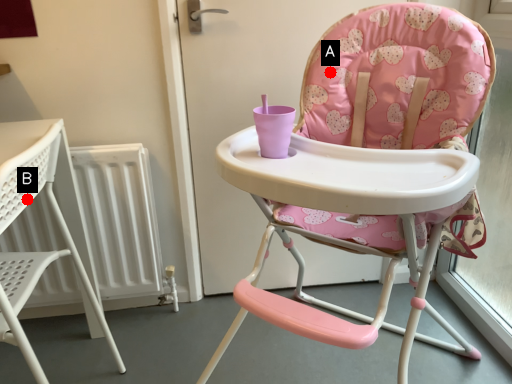
Question: Two points are circled on the image, labeled by A and B beside each circle. Which point is closer to the camera?

Choices:
 (A) A is closer
 (B) B is closer

Answer: (B)